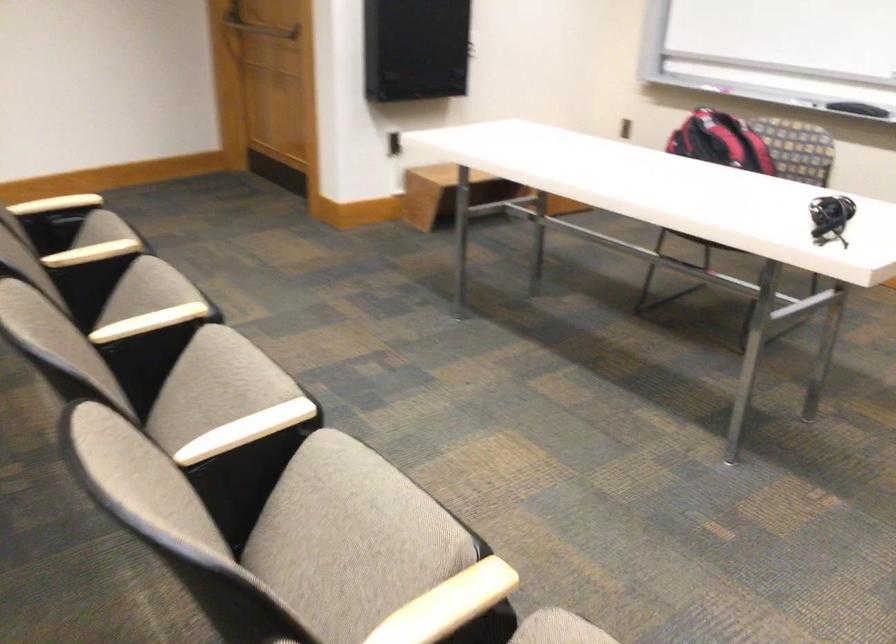
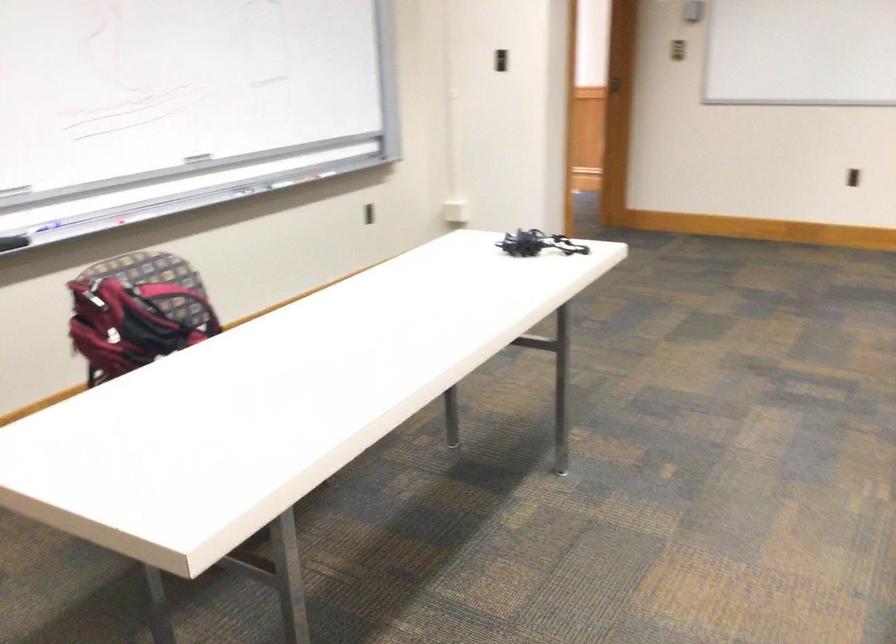
Question: I am providing you with two images of the same scene from different viewpoints. Please identify which objects are invisible in image2.

Choices:
 (A) keyboard
 (B) blue whiteboard marker
 (C) black whiteboard eraser
 (D) red and black backpack

Answer: (D)